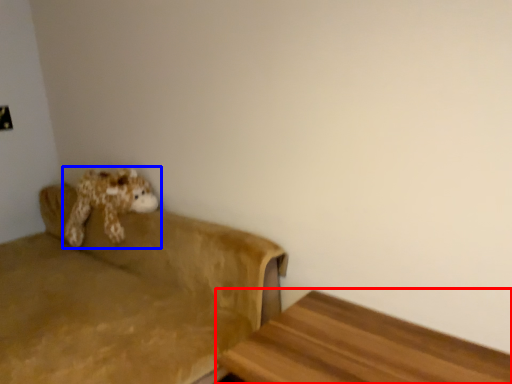
Question: Which object appears closest to the camera in this image, furniture (highlighted by a red box) or toy (highlighted by a blue box)?

Choices:
 (A) furniture
 (B) toy

Answer: (A)